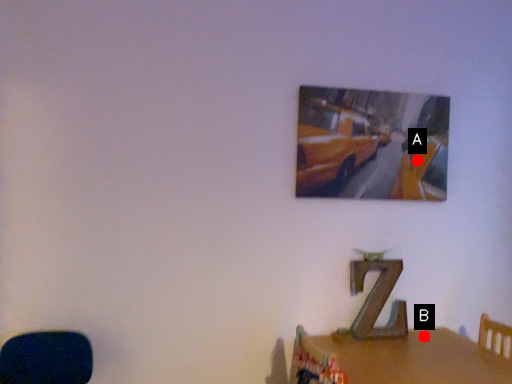
Question: Two points are circled on the image, labeled by A and B beside each circle. Among these points, which one is farthest from the camera?

Choices:
 (A) A is further
 (B) B is further

Answer: (A)